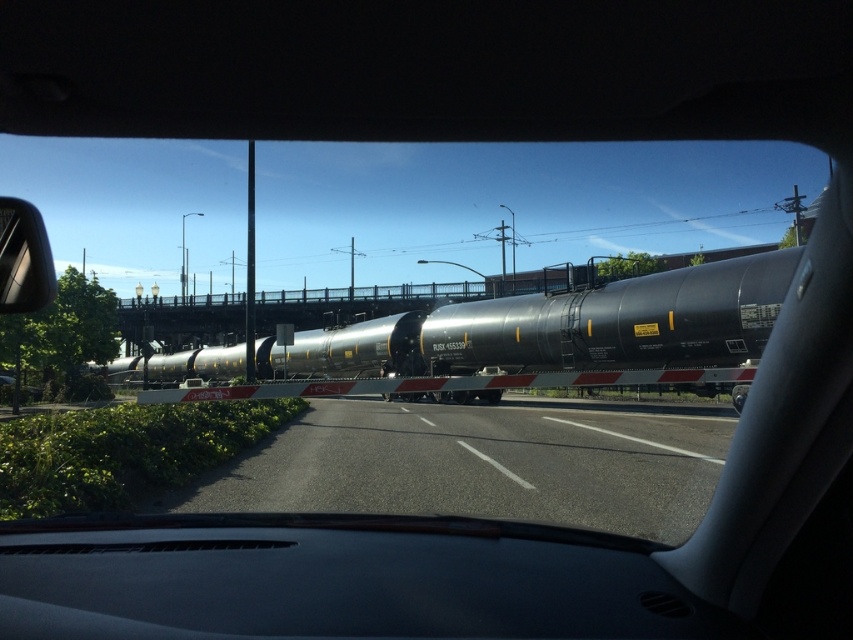
Is black asphalt highway at center below matte black tank car at center?

Actually, black asphalt highway at center is above matte black tank car at center.

Measure the distance between black asphalt highway at center and matte black tank car at center.

black asphalt highway at center is 8.16 meters away from matte black tank car at center.

Does point (329, 410) come farther from viewer compared to point (668, 358)?

Yes, point (329, 410) is farther from viewer.

Image resolution: width=853 pixels, height=640 pixels. In order to click on black asphalt highway at center in this screenshot , I will do `click(480, 465)`.

Is black asphalt highway at center closer to the viewer compared to silver metallic side mirror at left?

That is False.

Image resolution: width=853 pixels, height=640 pixels. What do you see at coordinates (480, 465) in the screenshot?
I see `black asphalt highway at center` at bounding box center [480, 465].

Which is in front, point (312, 403) or point (18, 243)?

Point (18, 243) is more forward.

Locate an element on the screen. The width and height of the screenshot is (853, 640). black asphalt highway at center is located at coordinates (480, 465).

Does matte black tank car at center have a greater height compared to silver metallic side mirror at left?

Indeed, matte black tank car at center has a greater height compared to silver metallic side mirror at left.

The image size is (853, 640). I want to click on matte black tank car at center, so click(561, 328).